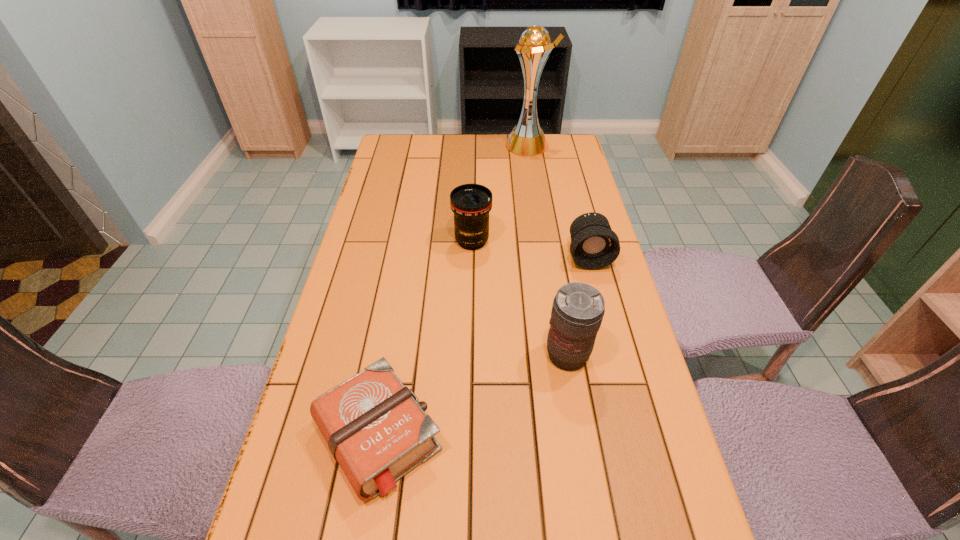
This screenshot has width=960, height=540. Find the location of `free location located on the front-facing side of the farthest object`. free location located on the front-facing side of the farthest object is located at coordinates (461, 145).

Locate an element on the screen. The height and width of the screenshot is (540, 960). vacant space located 0.280m on the front-facing side of the farthest object is located at coordinates (436, 145).

This screenshot has height=540, width=960. I want to click on vacant point located on the side of the nearest telephoto lens where the control switches are located, so click(597, 531).

Locate an element on the screen. free location located 0.130m on the right of the third tallest object is located at coordinates (534, 241).

Locate an element on the screen. This screenshot has height=540, width=960. free space located at the front element of the fourth tallest object is located at coordinates (596, 286).

At what (x,y) coordinates should I click in order to perform the action: click on vacant space located 0.240m on the right of the shortest object. Please return your answer as a coordinate pair (x, y). This screenshot has height=540, width=960. Looking at the image, I should click on (561, 436).

This screenshot has height=540, width=960. Identify the location of object at the far edge. (527, 138).

Locate an element on the screen. The image size is (960, 540). object that is at the left edge is located at coordinates (376, 429).

Find the location of a particular element. Image resolution: width=960 pixels, height=540 pixels. trophy positioned at the right edge is located at coordinates (527, 138).

Image resolution: width=960 pixels, height=540 pixels. What are the coordinates of `object present at the far right corner` in the screenshot? It's located at (527, 138).